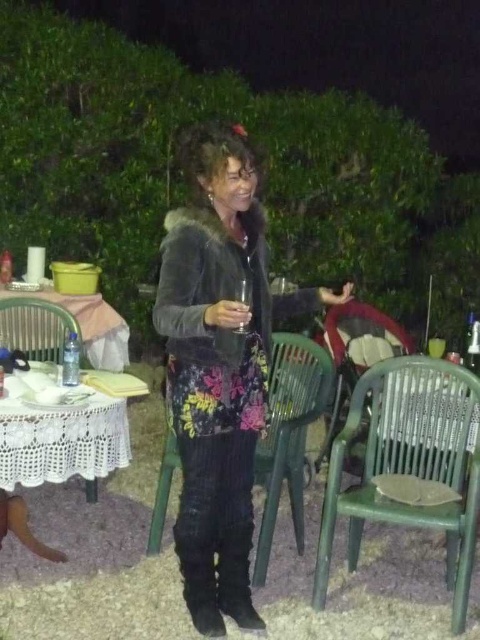
You are standing at the point labeled point (440,394) and want to move to the woman holding a glass in her right hand. The distance between you and the viewer is 2.64 meters. Can you reach the woman without moving past the viewer?

The distance between point (440,394) and the viewer is 2.64 meters. Since you are at point (440,394), you are 2.64 meters away from the viewer. To reach the woman, you would need to move towards her, but since the viewer is between you and the woman, you would have to pass the viewer to get closer. Therefore, you cannot reach the woman without moving past the viewer.

You are at a party and want to sit down. You see a fuzzy gray jacket at center and a green plastic chair at center. Which object is closer to your left side?

The fuzzy gray jacket at center is to the left of the green plastic chair at center, so it is closer to your left side.

You are at a nighttime gathering in a garden and want to sit down. There is a green plastic chair at lower right. Can you estimate its exact location in the image using coordinates?

The green plastic chair at lower right is located at coordinates point (410, 465).